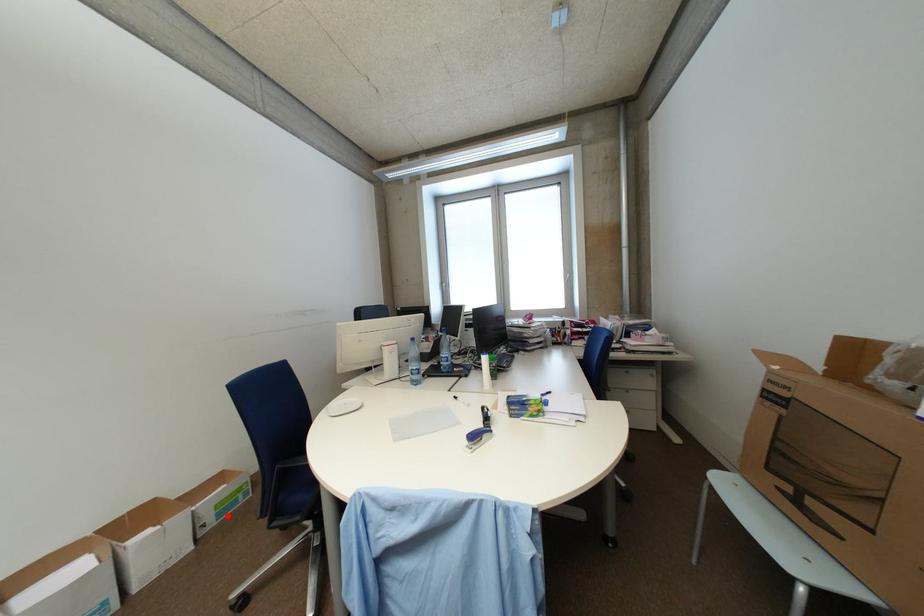
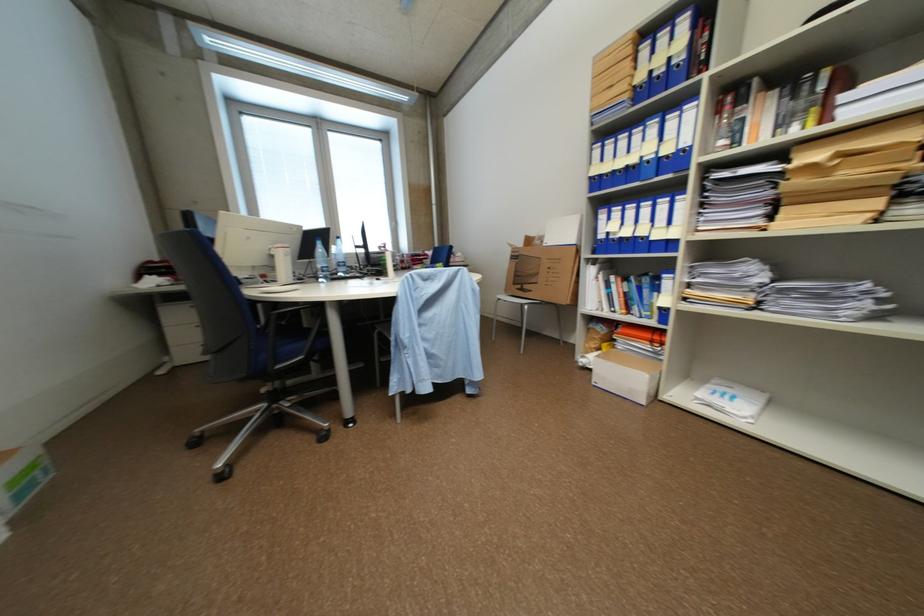
Question: I am providing you with two images of the same scene from different viewpoints. A red point is shown in image1. For the corresponding object point in image2, is it positioned nearer or farther from the camera?

Choices:
 (A) Nearer
 (B) Farther

Answer: (B)